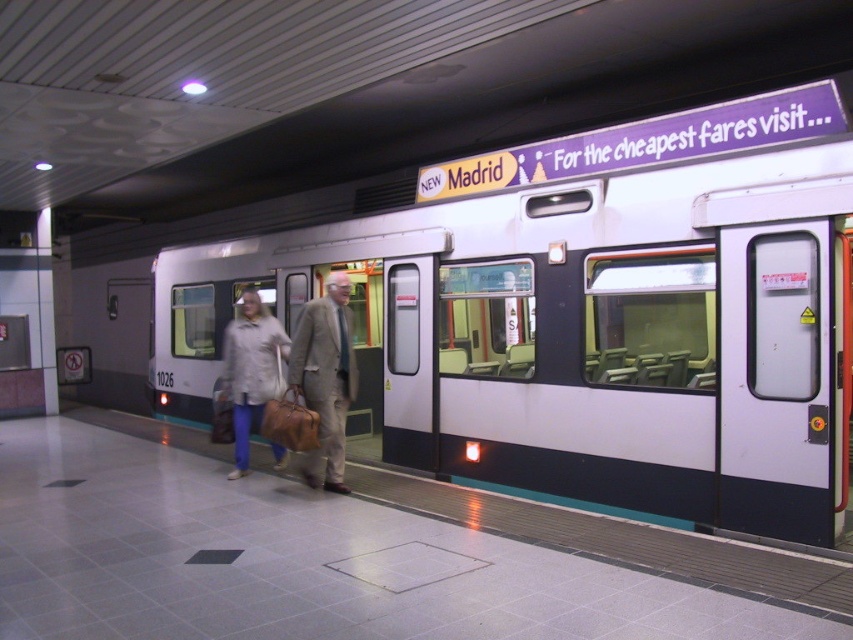
This screenshot has width=853, height=640. What do you see at coordinates (325, 380) in the screenshot? I see `light beige fabric suit at center` at bounding box center [325, 380].

Is point (314, 369) more distant than point (228, 364)?

No, it is not.

Identify the location of light beige fabric suit at center. This screenshot has height=640, width=853. (325, 380).

Is white glossy train at center bigger than light beige coat at center?

No.

Measure the distance between white glossy train at center and camera.

They are 33.39 feet apart.

Identify the location of white glossy train at center. This screenshot has height=640, width=853. (593, 314).

What are the coordinates of `white glossy train at center` in the screenshot? It's located at (593, 314).

Between point (805, 342) and point (346, 278), which one is positioned behind?

The point (346, 278) is more distant.

What do you see at coordinates (593, 314) in the screenshot? This screenshot has height=640, width=853. I see `white glossy train at center` at bounding box center [593, 314].

The width and height of the screenshot is (853, 640). Find the location of `white glossy train at center`. white glossy train at center is located at coordinates (593, 314).